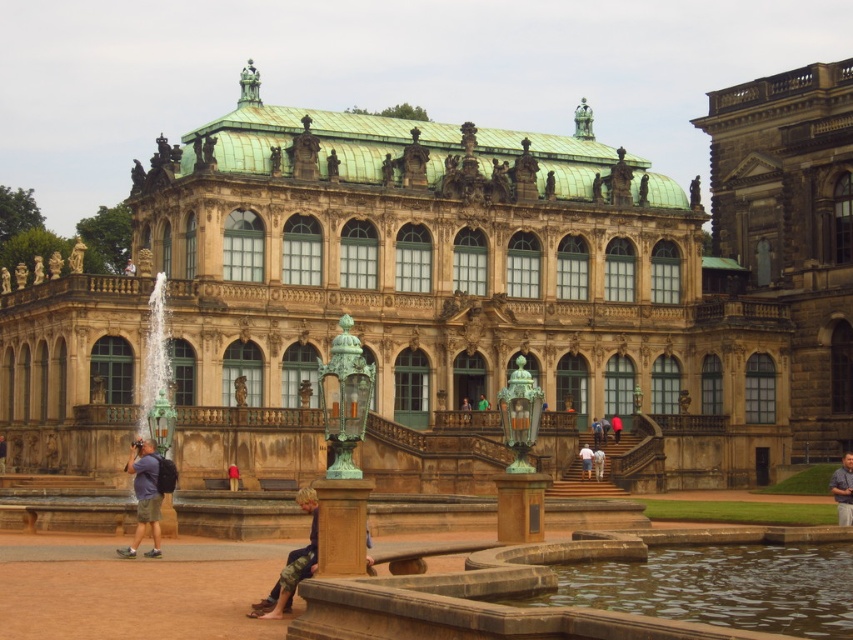
In the scene shown: You are a visitor at the grand building and want to check both the red velvet coat at center and the brown leather jacket at lower center. According to the scene, which item is positioned higher up?

The brown leather jacket at lower center is positioned higher up than the red velvet coat at center.

You are standing at the base of the grand building and see two points marked on the facade. The first point is at coordinate point (42, 307) and the second is at point (479, 401). Which point is closer to you as you face the building?

Point (42, 307) is in front of point (479, 401), so it is closer to you as you face the building.

You are standing in front of the grand building and notice a specific point marked at coordinates (469, 282). Based on the description provided, can you determine which part of the building this point corresponds to?

The point at coordinates (469, 282) is located on the brown stone palace at center.